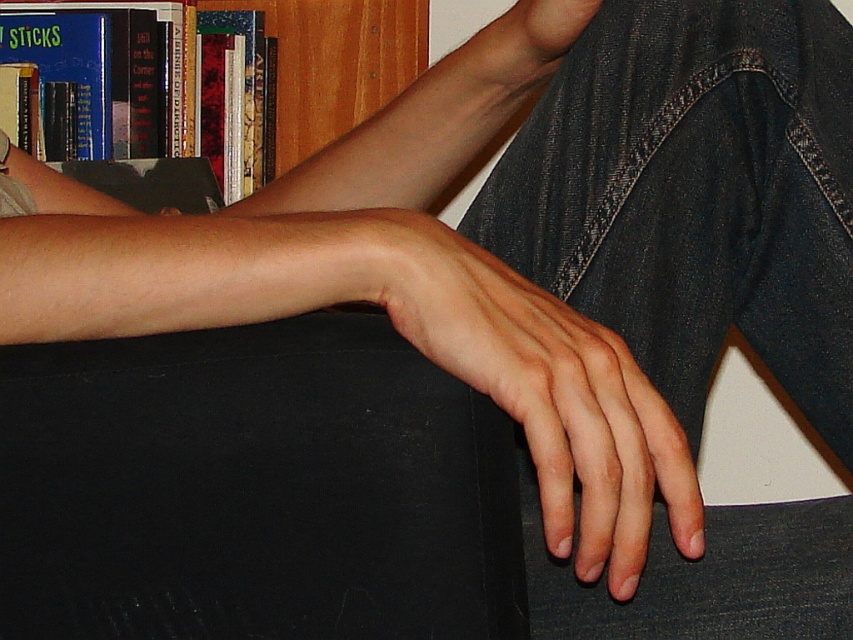
You are a photographer standing at the camera position. You want to place a small 10 cm ruler on the surface between the two arms shown in the image. The point where you want to place the ruler is exactly at point (512, 220). Given that the distance from the camera to this point is 63.09 centimeters, will the ruler be entirely visible in the image?

The distance from the camera to the point (512, 220) is 63.09 centimeters. Since the ruler is only 10 cm long, it will fit within the visible area at that distance and thus will be entirely visible in the image.

You are organizing a small party and need to place a 10cm wide decorative plate between the dark blue denim jeans at lower right and the wooden bookcase at upper left. Considering their thickness, will the space between them accommodate the plate?

The dark blue denim jeans at lower right is thinner than the wooden bookcase at upper left. Since the jeans are thinner, the space between them might be sufficient to place the 10cm wide plate, but the exact distance isn not provided. However, based on their relative thickness, it is plausible the space could accommodate the plate.

You are a photographer trying to capture the texture of the hand at the center of the image. Given that the camera is focused on the bookshelf in the background, will the hand at point (x=543, y=392) be in focus?

The point (x=543, y=392) corresponds to the smooth skin hand at center. Since the camera is focused on the bookshelf in the background, the hand at center will be out of focus.